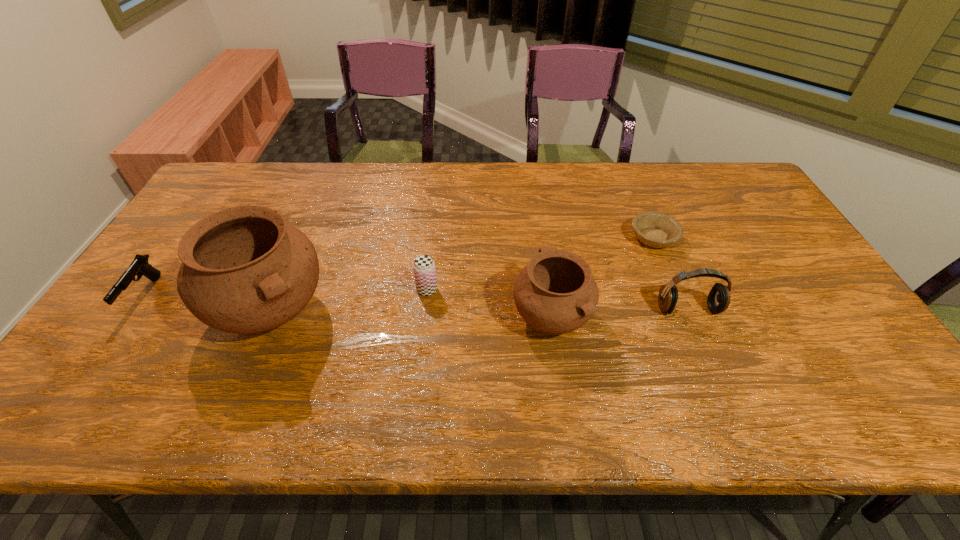
The height and width of the screenshot is (540, 960). Find the location of `the second object from left to right`. the second object from left to right is located at coordinates (244, 270).

Locate an element on the screen. The width and height of the screenshot is (960, 540). the left pottery is located at coordinates (244, 270).

Find the location of a particular element. the second tallest object is located at coordinates (556, 293).

Find the location of a particular element. the third object from right to left is located at coordinates (556, 293).

In order to click on bowl in this screenshot , I will do `click(654, 229)`.

Find the location of `the shortest object`. the shortest object is located at coordinates (654, 229).

The width and height of the screenshot is (960, 540). I want to click on beer can, so click(424, 269).

Where is `gun`? This screenshot has width=960, height=540. gun is located at coordinates (139, 266).

I want to click on the second shortest object, so click(x=139, y=266).

Identify the location of the fourth shortest object. (719, 298).